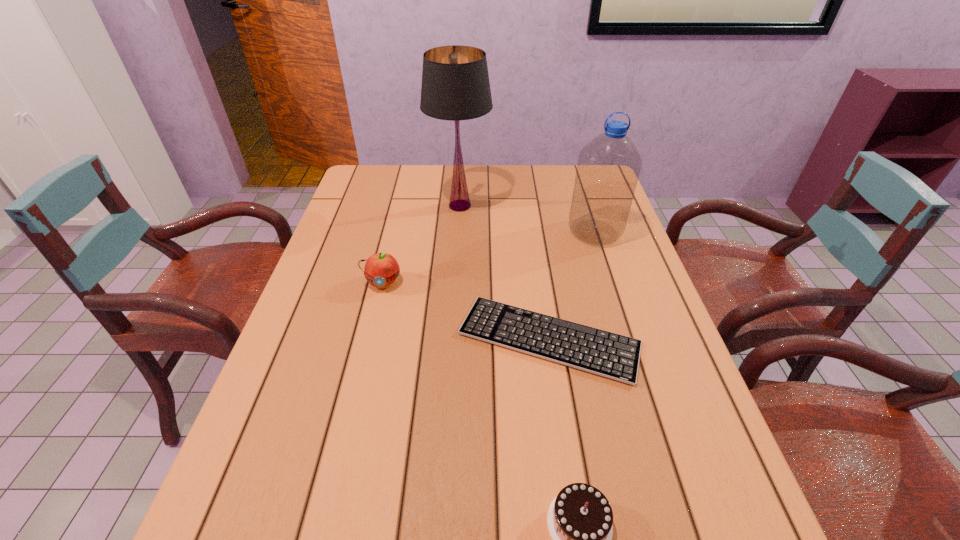
Where is `the tallest object`? The image size is (960, 540). the tallest object is located at coordinates (455, 86).

You are a GUI agent. You are given a task and a screenshot of the screen. Output one action in this format:
    pyautogui.click(x=<x>, y=<y>)
    Task: Click on the water jug
    The image size is (960, 540).
    Given the screenshot: What is the action you would take?
    pyautogui.click(x=608, y=168)

Identify the location of the third nearest object. The width and height of the screenshot is (960, 540). (381, 269).

Locate an element on the screen. This screenshot has width=960, height=540. the third tallest object is located at coordinates (381, 269).

The image size is (960, 540). I want to click on the second nearest object, so click(611, 355).

The width and height of the screenshot is (960, 540). In order to click on computer keyboard in this screenshot , I will do `click(611, 355)`.

Identify the location of free region located on the front-facing side of the tallest object. The image size is (960, 540). (538, 206).

In order to click on vacant position located on the front of the water jug in this screenshot , I will do `click(638, 364)`.

The image size is (960, 540). What are the coordinates of `free location located 0.360m on the back of the leftmost object` in the screenshot? It's located at (403, 199).

I want to click on free location located on the front of the computer keyboard, so click(562, 423).